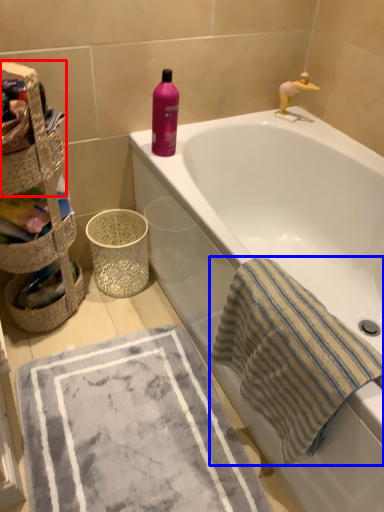
Question: Which object appears closest to the camera in this image, basket container (highlighted by a red box) or beach towel (highlighted by a blue box)?

Choices:
 (A) basket container
 (B) beach towel

Answer: (B)